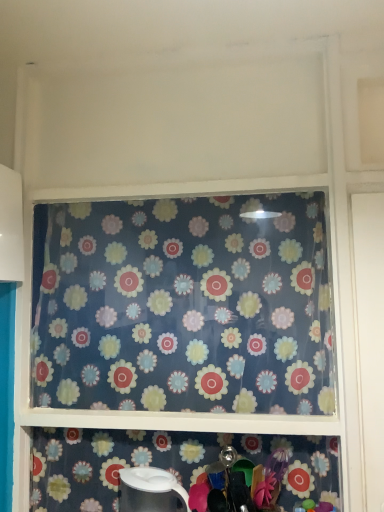
Question: Is white glossy pitcher at lower center bigger than white glossy kettle at lower center?

Choices:
 (A) yes
 (B) no

Answer: (A)

Question: Does white glossy pitcher at lower center have a lesser height compared to white glossy kettle at lower center?

Choices:
 (A) yes
 (B) no

Answer: (B)

Question: Is white glossy pitcher at lower center to the left of white glossy kettle at lower center from the viewer's perspective?

Choices:
 (A) no
 (B) yes

Answer: (A)

Question: From a real-world perspective, is white glossy pitcher at lower center below white glossy kettle at lower center?

Choices:
 (A) yes
 (B) no

Answer: (B)

Question: Can you confirm if white glossy pitcher at lower center is taller than white glossy kettle at lower center?

Choices:
 (A) yes
 (B) no

Answer: (A)

Question: Is white glossy pitcher at lower center looking in the opposite direction of white glossy kettle at lower center?

Choices:
 (A) no
 (B) yes

Answer: (B)

Question: Is floral-patterned fabric at center inside white glossy pitcher at lower center?

Choices:
 (A) no
 (B) yes

Answer: (A)

Question: Considering the relative sizes of white glossy pitcher at lower center and floral-patterned fabric at center in the image provided, is white glossy pitcher at lower center smaller than floral-patterned fabric at center?

Choices:
 (A) yes
 (B) no

Answer: (A)

Question: From the image's perspective, is white glossy pitcher at lower center over floral-patterned fabric at center?

Choices:
 (A) no
 (B) yes

Answer: (A)

Question: Is white glossy pitcher at lower center at the right side of floral-patterned fabric at center?

Choices:
 (A) no
 (B) yes

Answer: (B)

Question: Is white glossy pitcher at lower center outside of floral-patterned fabric at center?

Choices:
 (A) yes
 (B) no

Answer: (A)

Question: Is white glossy pitcher at lower center facing towards floral-patterned fabric at center?

Choices:
 (A) yes
 (B) no

Answer: (B)

Question: From a real-world perspective, does white glossy kettle at lower center sit lower than floral-patterned fabric at center?

Choices:
 (A) yes
 (B) no

Answer: (A)